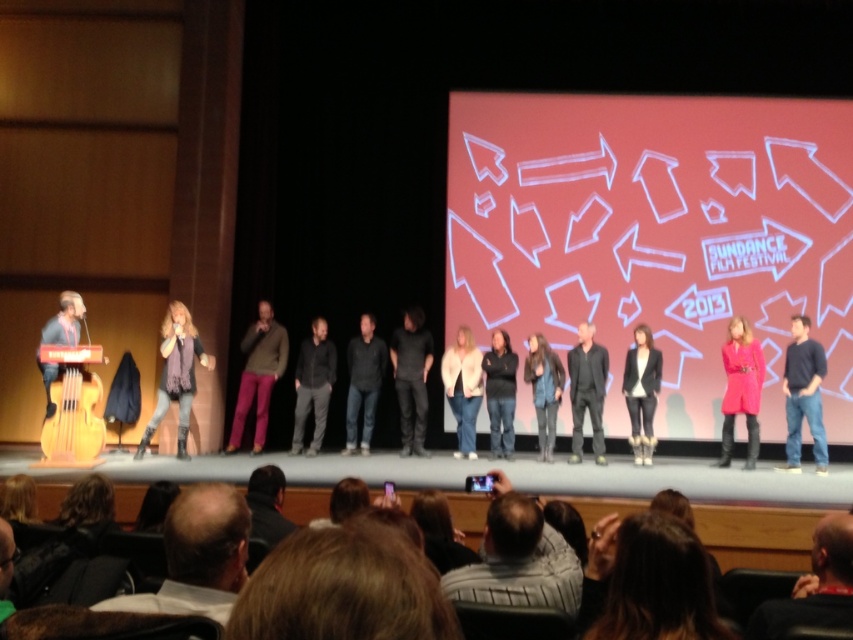
Does brown hair at lower center have a smaller size compared to dark gray suit at center?

Indeed, brown hair at lower center has a smaller size compared to dark gray suit at center.

Describe the element at coordinates (647, 580) in the screenshot. I see `brown hair at lower center` at that location.

At what (x,y) coordinates should I click in order to perform the action: click on brown hair at lower center. Please return your answer as a coordinate pair (x, y). This screenshot has width=853, height=640. Looking at the image, I should click on (647, 580).

In the scene shown: Which of these two, brown hair at lower center or gray striped sweater at lower center, stands taller?

gray striped sweater at lower center

Who is more distant from viewer, (582, 609) or (560, 609)?

The point (582, 609) is more distant.

The width and height of the screenshot is (853, 640). In order to click on brown hair at lower center in this screenshot , I will do `click(647, 580)`.

Who is positioned more to the left, bald head at lower center or dark gray/black fabric at center?

dark gray/black fabric at center is more to the left.

Describe the element at coordinates (198, 556) in the screenshot. Image resolution: width=853 pixels, height=640 pixels. I see `bald head at lower center` at that location.

Image resolution: width=853 pixels, height=640 pixels. I want to click on bald head at lower center, so click(198, 556).